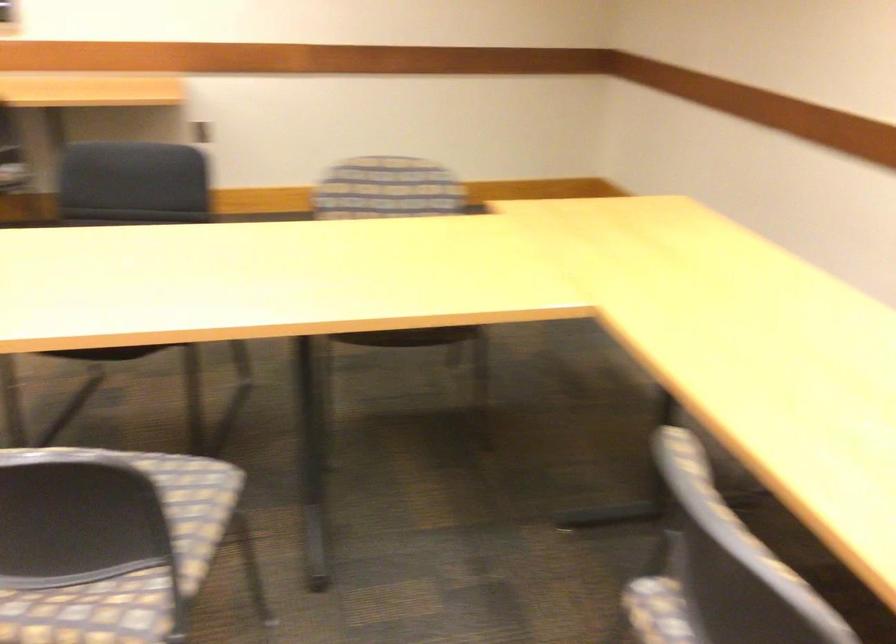
Where would you sit the dark chair sitting surface? Please return your answer as a coordinate pair (x, y).

(410, 337)